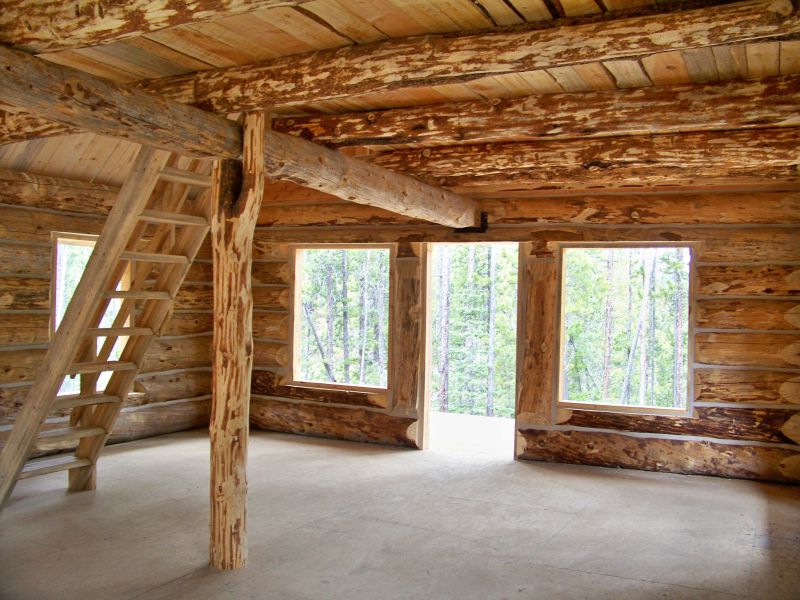
The width and height of the screenshot is (800, 600). I want to click on log beam, so click(361, 183).